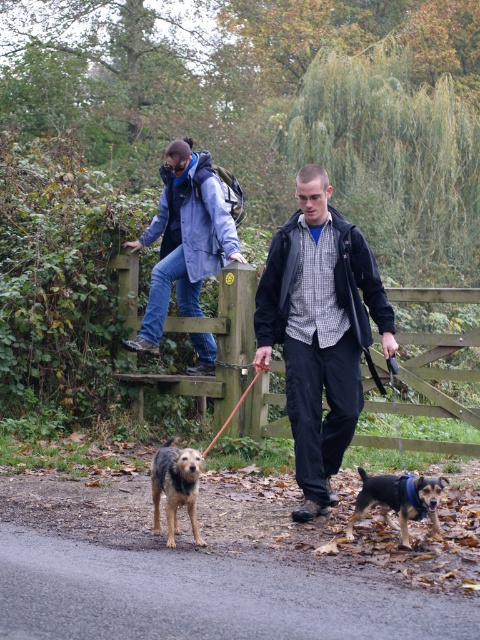
Between matte black jacket at center and brown and black fur at lower right, which one has less height?

brown and black fur at lower right is shorter.

Who is taller, matte black jacket at center or brown and black fur at lower right?

matte black jacket at center is taller.

Is point (340, 346) in front of point (369, 499)?

No, it is not.

You are a GUI agent. You are given a task and a screenshot of the screen. Output one action in this format:
    pyautogui.click(x=<x>, y=<y>)
    Task: Click on the matte black jacket at center
    The image size is (480, 640).
    Given the screenshot: What is the action you would take?
    320,330

Which is more to the left, brown and black fur at lower right or red nylon leash at center?

red nylon leash at center

Locate an element on the screen. This screenshot has width=480, height=640. brown and black fur at lower right is located at coordinates (397, 499).

Where is `brown and black fur at lower right`? brown and black fur at lower right is located at coordinates (397, 499).

Does point (336, 333) come in front of point (257, 371)?

That is True.

Who is more distant from viewer, (360, 330) or (248, 387)?

Point (248, 387)

Where is `matte black jacket at center`? This screenshot has width=480, height=640. matte black jacket at center is located at coordinates coord(320,330).